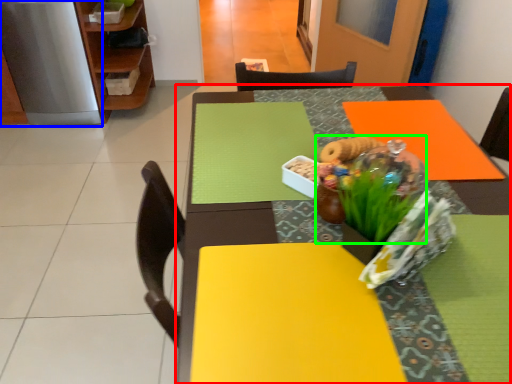
Question: Which is farther away from table (highlighted by a red box)? appliance (highlighted by a blue box) or floral arrangement (highlighted by a green box)?

Choices:
 (A) appliance
 (B) floral arrangement

Answer: (A)